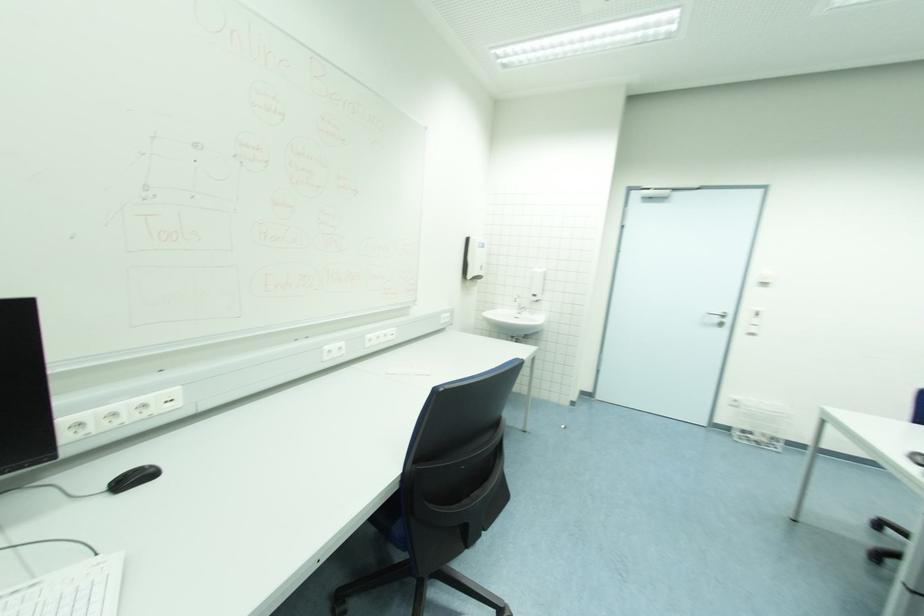
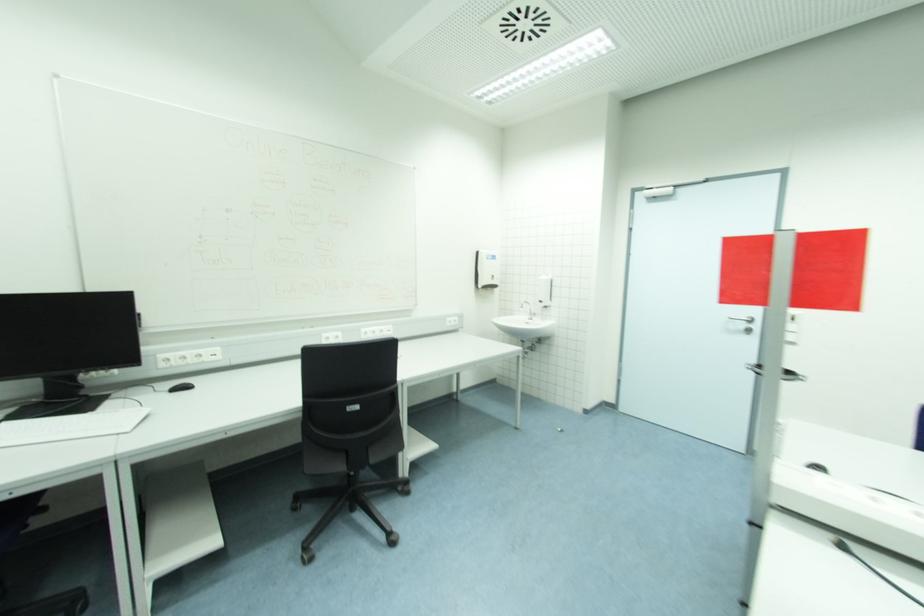
The point at (719, 321) is marked in the first image. Where is the corresponding point in the second image?

(746, 326)